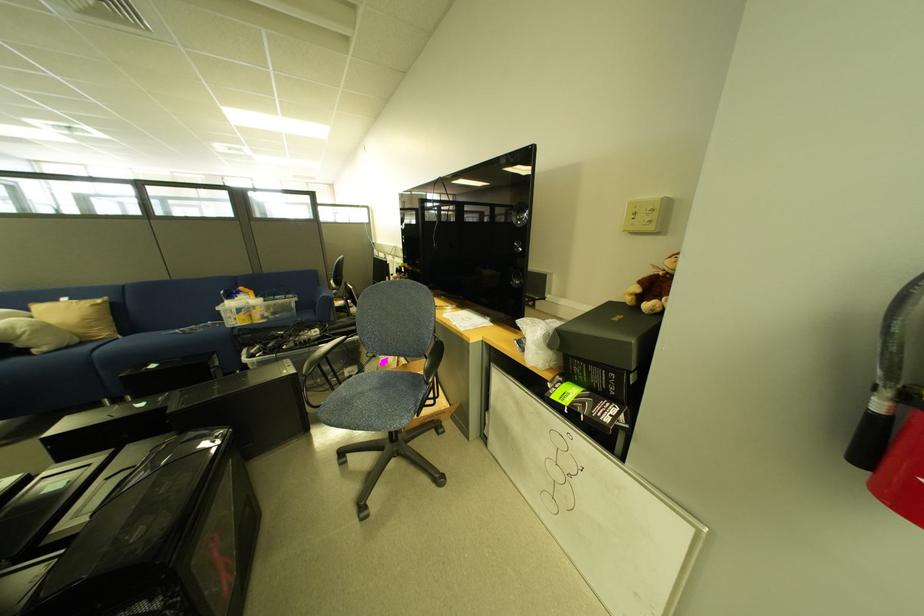
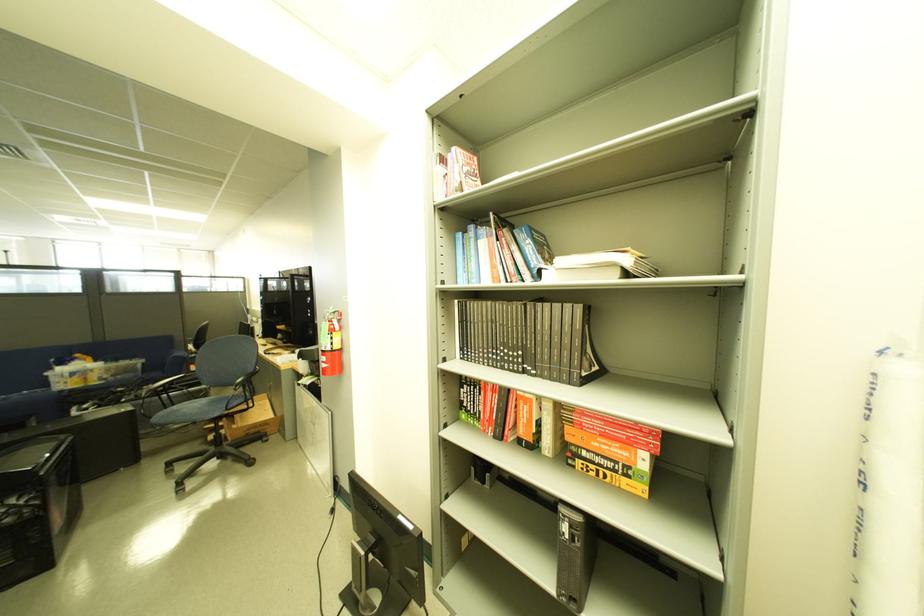
In the second image, find the point that corresponds to the point at 301,338 in the first image.

(142, 392)